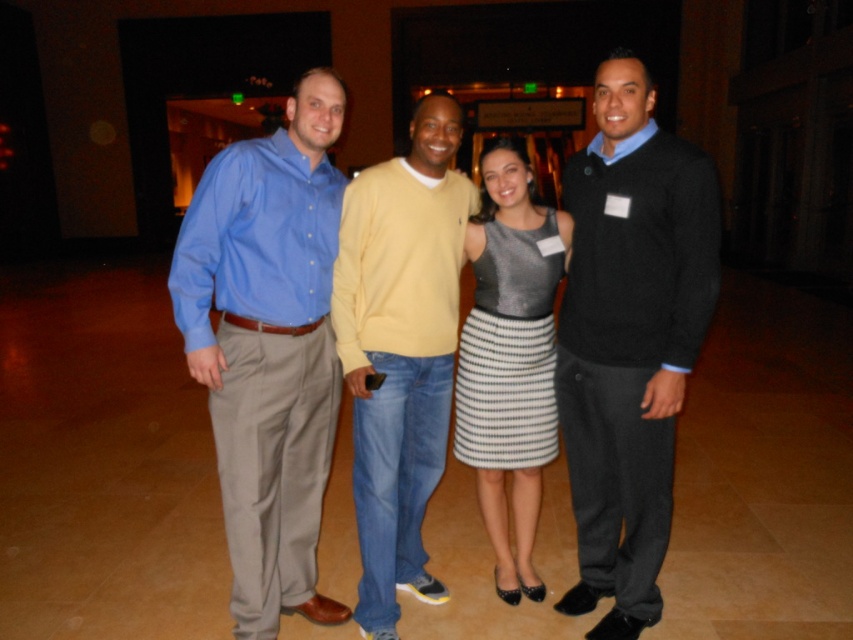
You are standing in the same hall and want to know which person is taller between the matte blue shirt at left and the light yellow sweater at center. Can you tell me?

The matte blue shirt at left is taller than the light yellow sweater at center.

You are at the entrance of the hall and want to greet the person wearing the shiny metallic dress at center without walking behind the matte blue shirt at left. Is this possible?

The matte blue shirt at left is in front of the shiny metallic dress at center, so you cannot directly approach the shiny metallic dress at center without moving around or past the matte blue shirt at left.